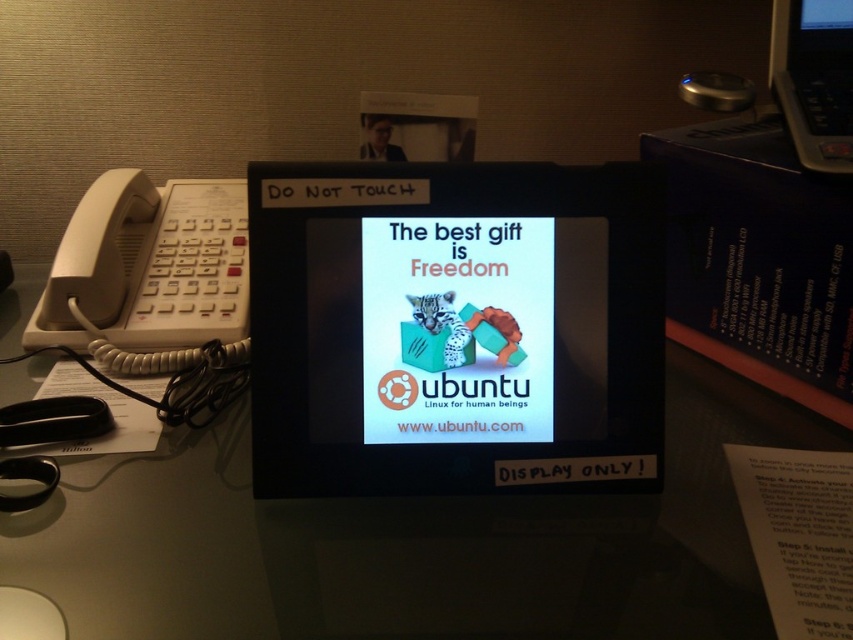
Question: Which point is closer to the camera?

Choices:
 (A) white plastic phone at left
 (B) black plastic phone at upper right

Answer: (B)

Question: Based on their relative distances, which object is farther from the matte black monitor at center?

Choices:
 (A) white plastic phone at left
 (B) black plastic phone at upper right

Answer: (B)

Question: Based on their relative distances, which object is nearer to the black glossy table at center?

Choices:
 (A) white plastic phone at left
 (B) black plastic phone at upper right
 (C) matte black monitor at center

Answer: (C)

Question: In this image, where is black glossy table at center located relative to white plastic phone at left?

Choices:
 (A) below
 (B) above

Answer: (A)

Question: Does black glossy table at center appear on the left side of black plastic phone at upper right?

Choices:
 (A) yes
 (B) no

Answer: (A)

Question: Can you confirm if matte black monitor at center is positioned above black plastic phone at upper right?

Choices:
 (A) yes
 (B) no

Answer: (B)